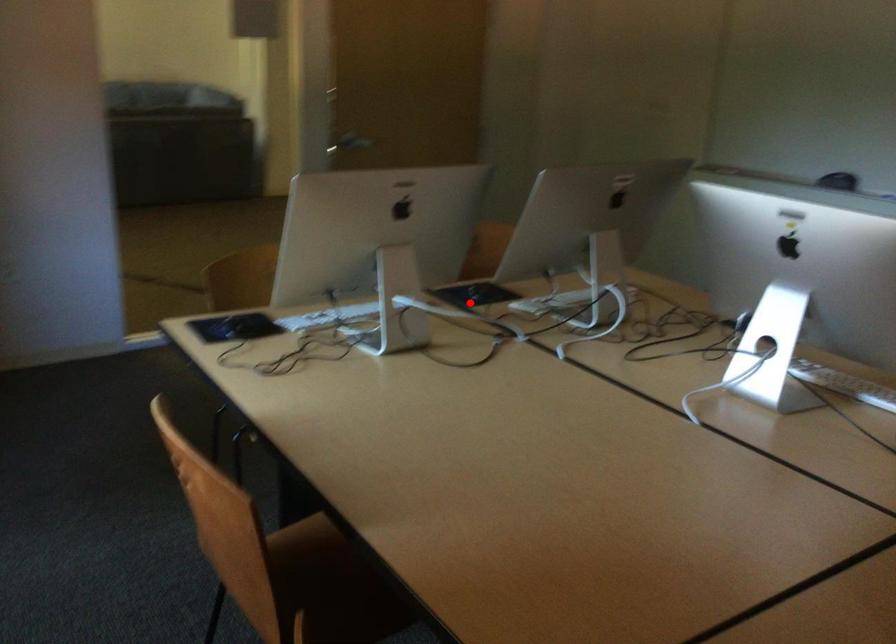
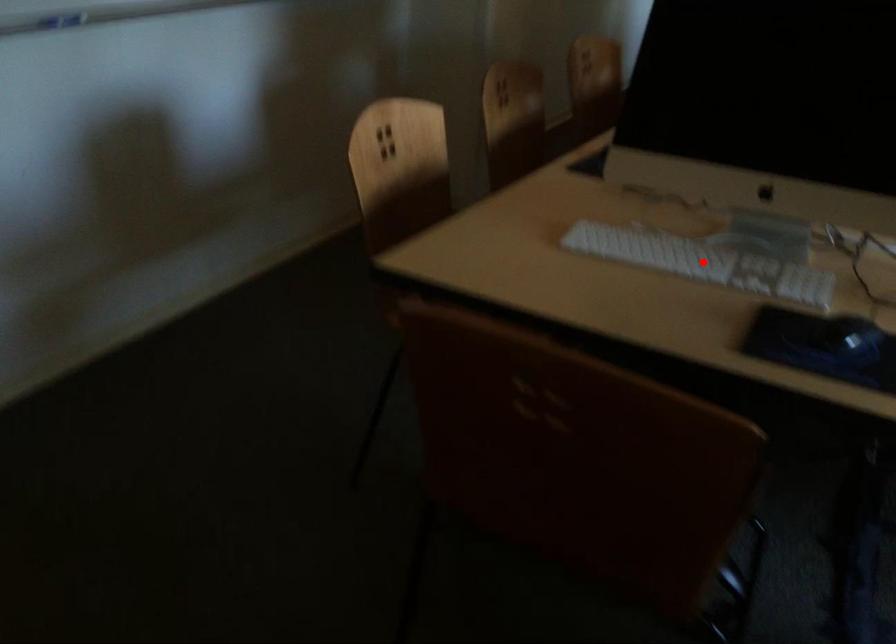
I am providing you with two images of the same scene from different viewpoints. A red point is marked on the first image and another point is marked on the second image. Do the highlighted points in image1 and image2 indicate the same real-world spot?

No